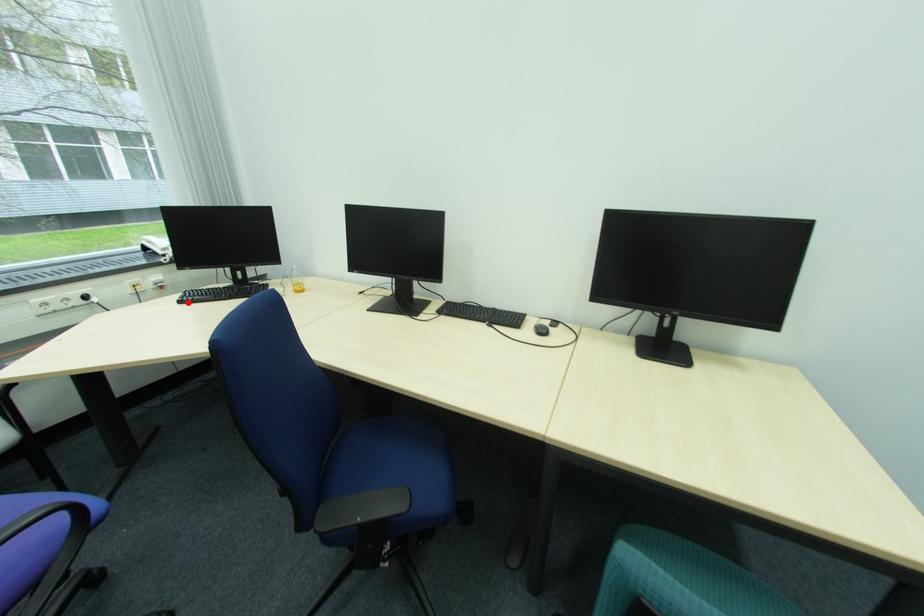
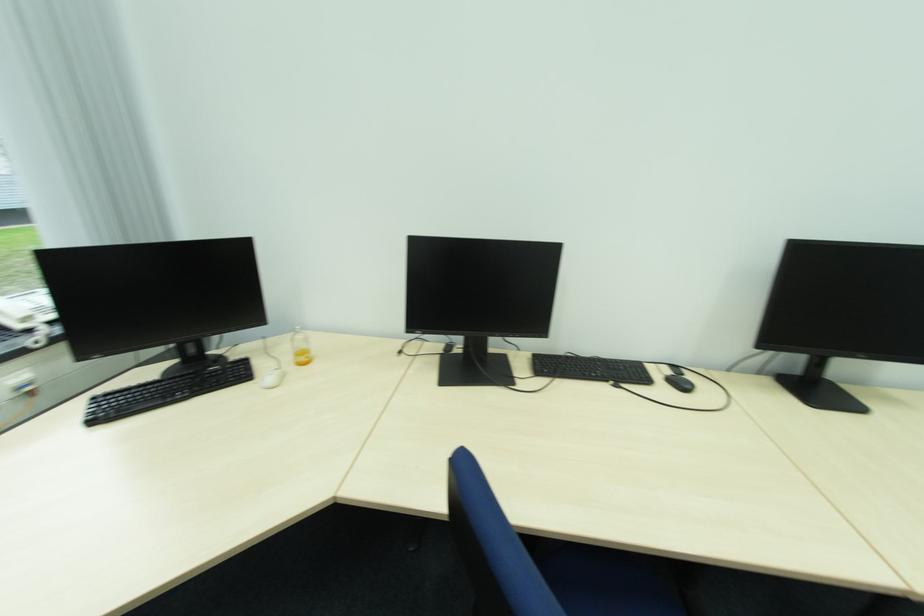
Find the pixel in the second image that matches the highlighted location in the first image.

(100, 422)